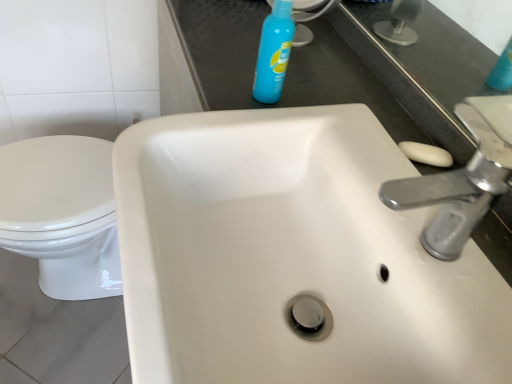
Question: Considering the relative positions of silver metallic faucet at upper right and white ceramic sink at center in the image provided, is silver metallic faucet at upper right to the right of white ceramic sink at center from the viewer's perspective?

Choices:
 (A) no
 (B) yes

Answer: (B)

Question: Does silver metallic faucet at upper right come behind white ceramic sink at center?

Choices:
 (A) yes
 (B) no

Answer: (A)

Question: Does silver metallic faucet at upper right turn towards white ceramic sink at center?

Choices:
 (A) no
 (B) yes

Answer: (A)

Question: From the image's perspective, is silver metallic faucet at upper right located above white ceramic sink at center?

Choices:
 (A) no
 (B) yes

Answer: (B)

Question: From a real-world perspective, is silver metallic faucet at upper right physically below white ceramic sink at center?

Choices:
 (A) no
 (B) yes

Answer: (A)

Question: Considering the relative sizes of silver metallic faucet at upper right and white ceramic sink at center in the image provided, is silver metallic faucet at upper right smaller than white ceramic sink at center?

Choices:
 (A) no
 (B) yes

Answer: (B)

Question: Could you tell me if blue plastic spray bottle at upper center is turned towards white glossy toilet at lower left?

Choices:
 (A) no
 (B) yes

Answer: (A)

Question: From the image's perspective, is blue plastic spray bottle at upper center located beneath white glossy toilet at lower left?

Choices:
 (A) yes
 (B) no

Answer: (B)

Question: Considering the relative positions of blue plastic spray bottle at upper center and white glossy toilet at lower left in the image provided, is blue plastic spray bottle at upper center to the right of white glossy toilet at lower left from the viewer's perspective?

Choices:
 (A) yes
 (B) no

Answer: (A)

Question: Can we say blue plastic spray bottle at upper center lies outside white glossy toilet at lower left?

Choices:
 (A) yes
 (B) no

Answer: (A)

Question: Is white glossy toilet at lower left at the back of blue plastic spray bottle at upper center?

Choices:
 (A) no
 (B) yes

Answer: (A)

Question: Could white glossy toilet at lower left be considered to be inside blue plastic spray bottle at upper center?

Choices:
 (A) no
 (B) yes

Answer: (A)

Question: Can you confirm if blue plastic spray bottle at upper center is positioned to the left of silver metallic faucet at upper right?

Choices:
 (A) yes
 (B) no

Answer: (A)